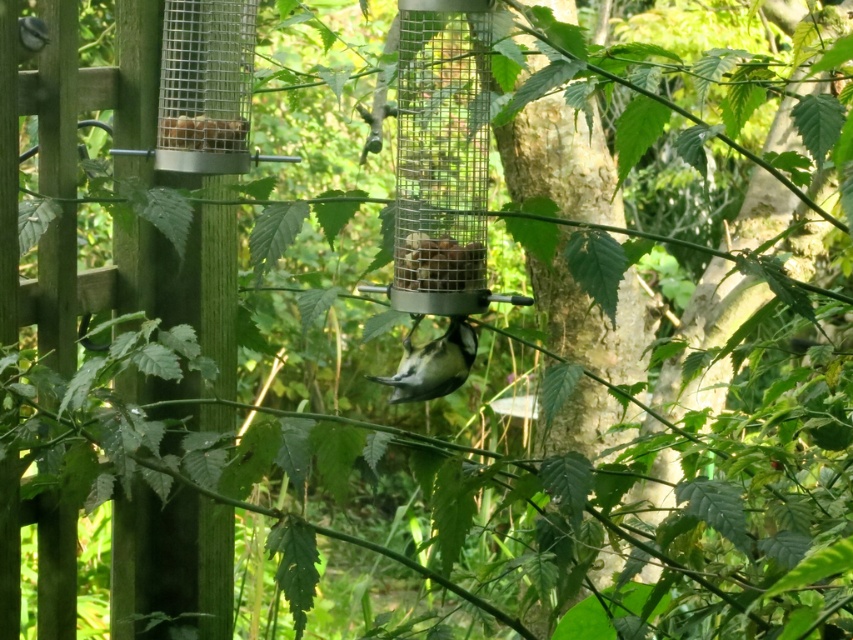
Does brown textured bird feeder at center appear over metal mesh container at upper left?

No, brown textured bird feeder at center is not above metal mesh container at upper left.

Who is lower down, brown textured bird feeder at center or metal mesh container at upper left?

brown textured bird feeder at center

Is point (396, 259) farther from viewer compared to point (206, 145)?

No, it is not.

You are a GUI agent. You are given a task and a screenshot of the screen. Output one action in this format:
    pyautogui.click(x=<x>, y=<y>)
    Task: Click on the brown textured bird feeder at center
    Image resolution: width=853 pixels, height=640 pixels.
    Given the screenshot: What is the action you would take?
    pyautogui.click(x=438, y=262)

Does metal mesh bird feeder at center have a lesser height compared to white matte bird at center?

In fact, metal mesh bird feeder at center may be taller than white matte bird at center.

Who is more distant from viewer, (434,64) or (415,374)?

The point (415,374) is more distant.

The width and height of the screenshot is (853, 640). In order to click on metal mesh bird feeder at center in this screenshot , I will do `click(440, 157)`.

Locate an element on the screen. The width and height of the screenshot is (853, 640). metal mesh bird feeder at center is located at coordinates (440, 157).

The image size is (853, 640). What do you see at coordinates (440, 157) in the screenshot? I see `metal mesh bird feeder at center` at bounding box center [440, 157].

Who is positioned more to the right, metal mesh bird feeder at center or brown textured bird feeder at center?

From the viewer's perspective, metal mesh bird feeder at center appears more on the right side.

Locate an element on the screen. The height and width of the screenshot is (640, 853). metal mesh bird feeder at center is located at coordinates (440, 157).